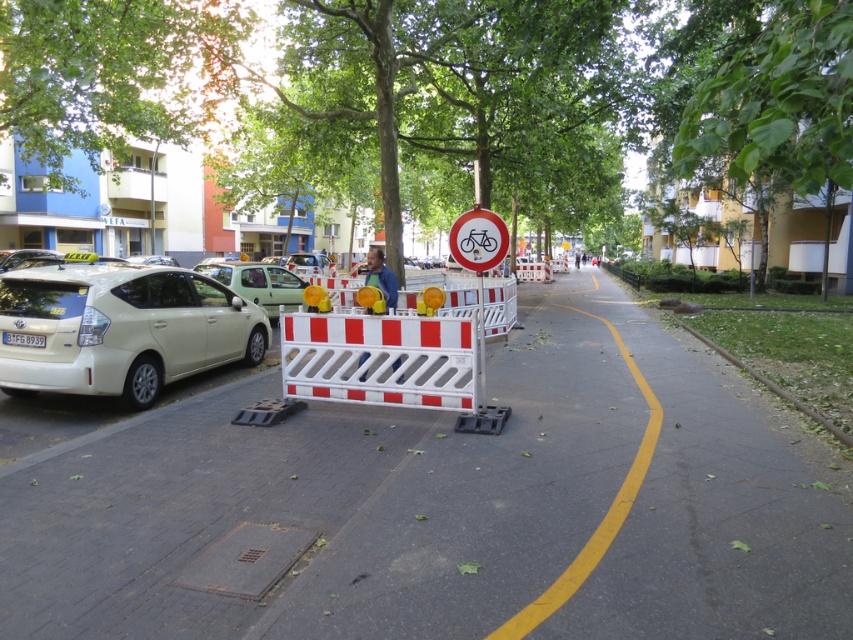
Question: Can you confirm if white matte hatchback at left is thinner than white plastic barricade at center?

Choices:
 (A) yes
 (B) no

Answer: (B)

Question: Among these objects, which one is farthest from the camera?

Choices:
 (A) white matte hatchback at left
 (B) green leafy tree at upper center
 (C) white plastic barrier at center
 (D) red circular sign with bicycle symbol at center

Answer: (A)

Question: Which object is closer to the camera taking this photo?

Choices:
 (A) white matte hatchback at left
 (B) white plastic barrier at center
 (C) red circular sign with bicycle symbol at center
 (D) white plastic barricade at center

Answer: (B)

Question: Considering the real-world distances, which object is farthest from the red circular sign with bicycle symbol at center?

Choices:
 (A) white matte hatchback at left
 (B) green leafy tree at center

Answer: (B)

Question: Is white plastic barricade at center above red circular sign with bicycle symbol at center?

Choices:
 (A) no
 (B) yes

Answer: (A)

Question: From the image, what is the correct spatial relationship of green leafy tree at center in relation to red circular sign with bicycle symbol at center?

Choices:
 (A) below
 (B) above

Answer: (B)